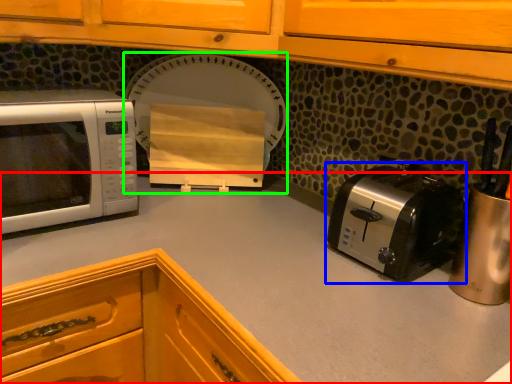
Question: Based on their relative distances, which object is farther from countertop (highlighted by a red box)? Choose from toaster (highlighted by a blue box) and appliance (highlighted by a green box).

Choices:
 (A) toaster
 (B) appliance

Answer: (B)